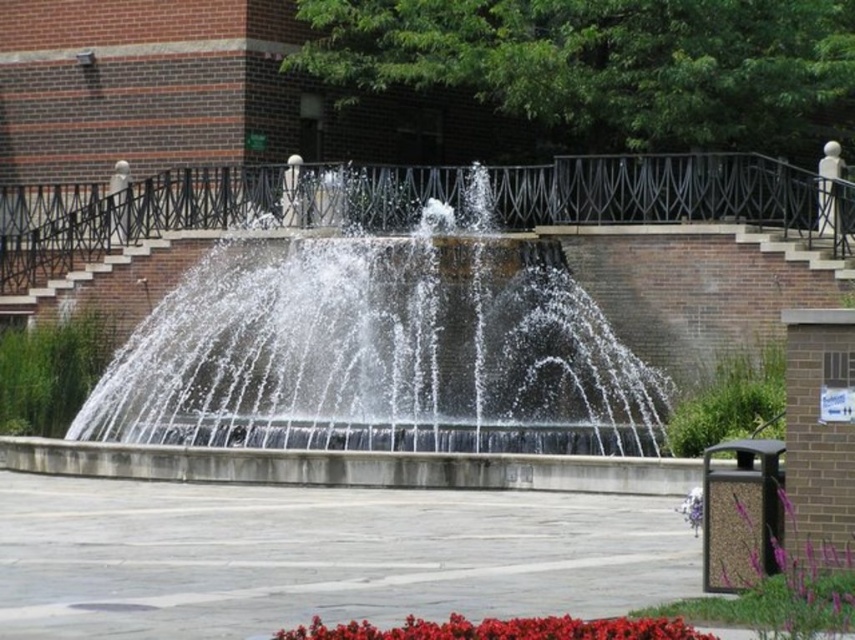
Does point (488, 198) come closer to viewer compared to point (637, 634)?

No, (488, 198) is further to viewer.

Which is in front, point (225, 291) or point (289, 636)?

Point (289, 636)

Find the location of a particular element. The height and width of the screenshot is (640, 855). clear concrete fountain at center is located at coordinates (382, 349).

Who is shorter, clear concrete fountain at center or purple matte flower at lower right?

With less height is purple matte flower at lower right.

Can you confirm if clear concrete fountain at center is positioned to the left of purple matte flower at lower right?

Yes, clear concrete fountain at center is to the left of purple matte flower at lower right.

Between point (485, 332) and point (697, 496), which one is positioned in front?

Point (697, 496)

Identify the location of clear concrete fountain at center. The height and width of the screenshot is (640, 855). (382, 349).

Does smooth glossy flowers at lower center appear under purple matte flower at lower right?

No.

Is smooth glossy flowers at lower center smaller than purple matte flower at lower right?

Correct, smooth glossy flowers at lower center occupies less space than purple matte flower at lower right.

Does point (658, 625) come in front of point (693, 488)?

That is True.

I want to click on smooth glossy flowers at lower center, so click(x=502, y=628).